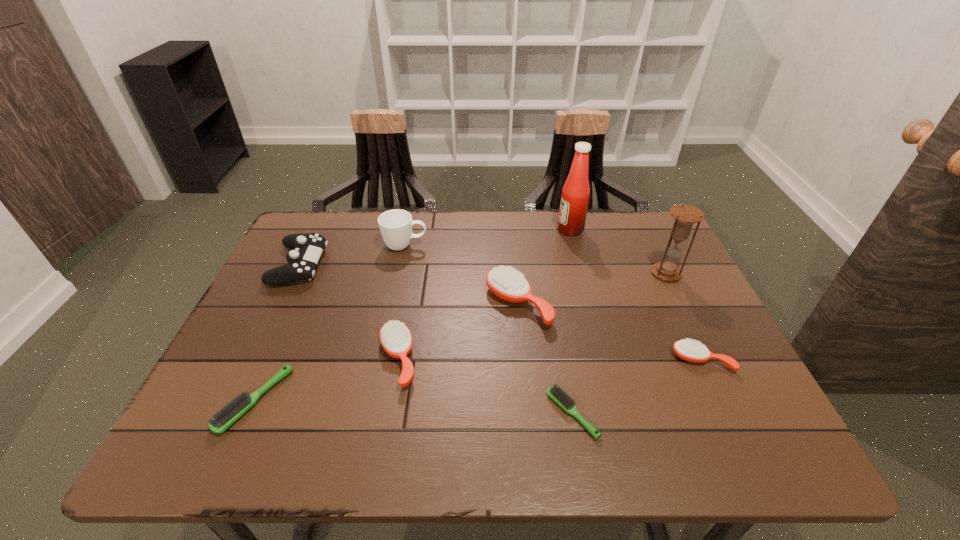
This screenshot has width=960, height=540. What are the coordinates of `the tallest object` in the screenshot? It's located at (575, 194).

Locate an element on the screen. The height and width of the screenshot is (540, 960). red condiment is located at coordinates (575, 194).

Find the location of a particular element. hourglass is located at coordinates (685, 216).

Identify the location of brown hourglass. Image resolution: width=960 pixels, height=540 pixels. (685, 216).

This screenshot has height=540, width=960. Find the location of `the seventh shortest object`. the seventh shortest object is located at coordinates (395, 225).

Find the location of a particular element. The image size is (960, 540). control is located at coordinates (302, 260).

The width and height of the screenshot is (960, 540). Find the location of `the biggest orange hairbrush`. the biggest orange hairbrush is located at coordinates (509, 284).

The image size is (960, 540). Identify the location of the second orange hairbrush from left to right. (509, 284).

Find the location of a particular element. the fourth shortest object is located at coordinates (395, 337).

In order to click on the leftmost orange hairbrush in this screenshot , I will do `click(395, 337)`.